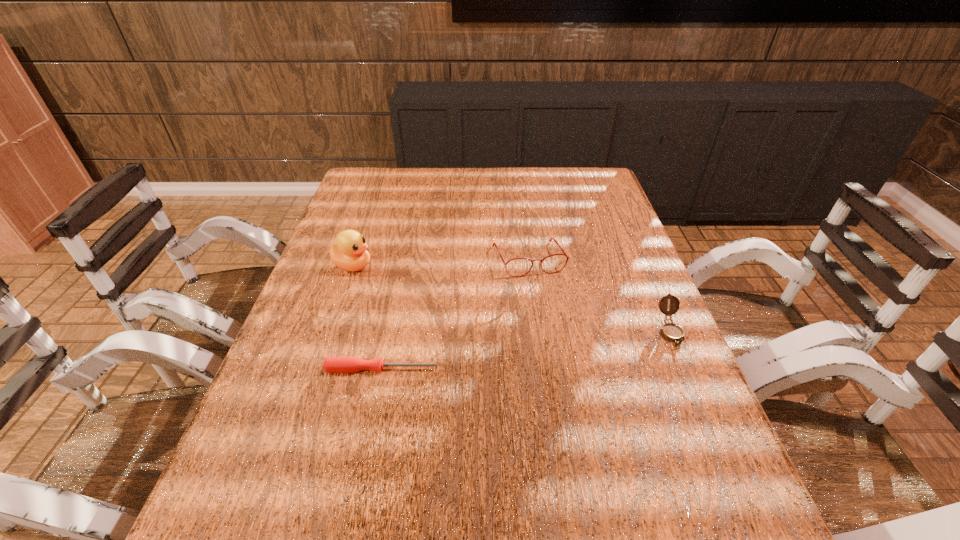
Find the location of a particular element. The image size is (960, 540). vacant space on the desktop that is between the shortest object and the rightmost object and is positioned on the face of the third object from left to right is located at coordinates (564, 345).

The image size is (960, 540). What are the coordinates of `vacant space on the desktop that is between the nearest object and the third farthest object and is positioned on the face of the tallest object` in the screenshot? It's located at (573, 344).